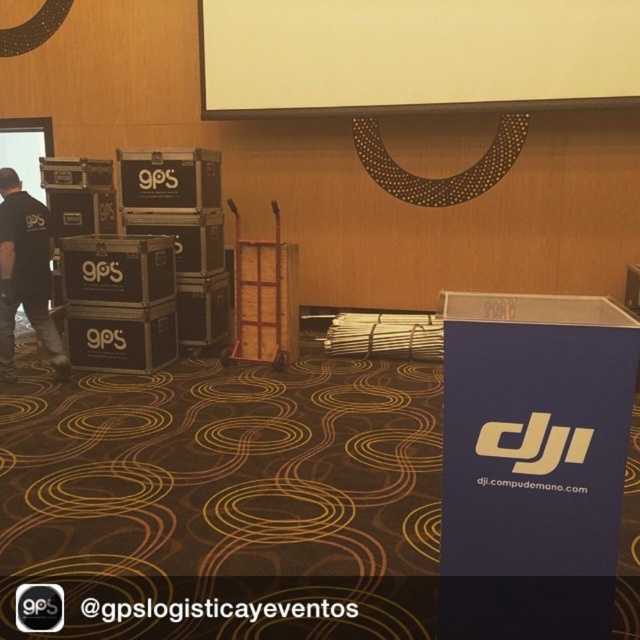
Does white matte projection screen at upper center have a lesser width compared to black fabric shirt at left?

No, white matte projection screen at upper center is not thinner than black fabric shirt at left.

This screenshot has width=640, height=640. Describe the element at coordinates (413, 54) in the screenshot. I see `white matte projection screen at upper center` at that location.

What are the coordinates of `white matte projection screen at upper center` in the screenshot? It's located at (413, 54).